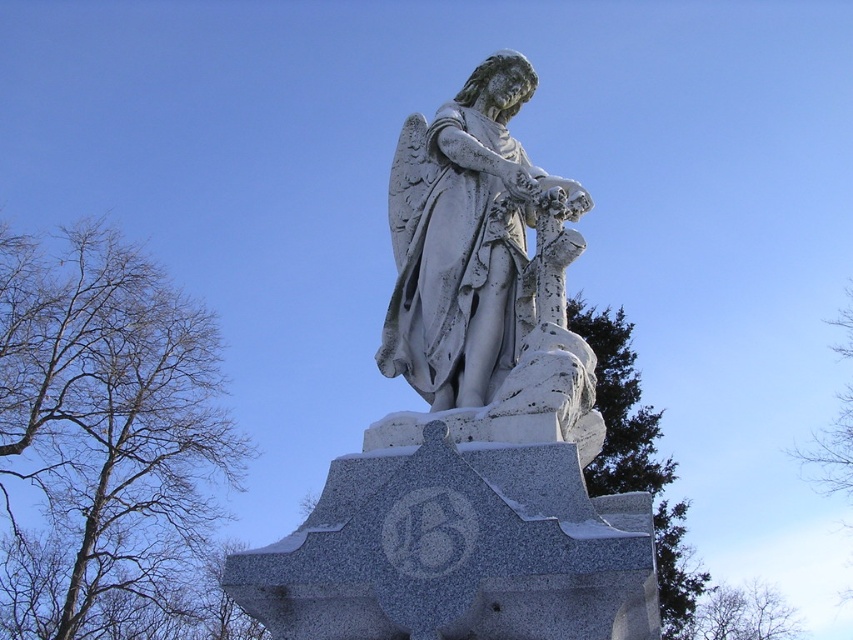
Does point (482, 198) come farther from viewer compared to point (616, 408)?

No, (482, 198) is closer to viewer.

What do you see at coordinates (462, 237) in the screenshot?
I see `white stone statue at center` at bounding box center [462, 237].

Which is behind, point (491, 84) or point (694, 592)?

The point (694, 592) is more distant.

Locate an element on the screen. The height and width of the screenshot is (640, 853). white stone statue at center is located at coordinates click(462, 237).

Describe the element at coordinates (636, 456) in the screenshot. I see `green textured stone at right` at that location.

Can you confirm if green textured stone at right is wider than green leafless branches at upper right?

Yes.

What do you see at coordinates (636, 456) in the screenshot? I see `green textured stone at right` at bounding box center [636, 456].

This screenshot has width=853, height=640. What are the coordinates of `green textured stone at right` in the screenshot? It's located at (636, 456).

Which is more to the left, bare branches at left or white stone statue at center?

From the viewer's perspective, bare branches at left appears more on the left side.

Is bare branches at left closer to camera compared to white stone statue at center?

No, bare branches at left is further to the viewer.

Measure the distance between bare branches at left and camera.

They are 174.68 meters apart.

Locate an element on the screen. bare branches at left is located at coordinates (109, 445).